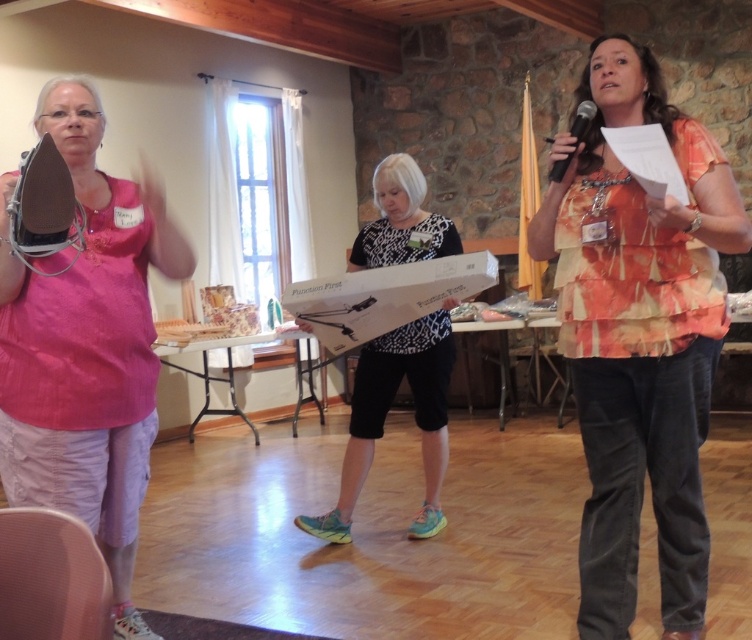
You are a photographer positioned in the center of the room. You need to capture a clear photo of both the matte pink shirt at left and the black plastic microphone at upper right. Which object should you focus on first to ensure both are in focus?

The matte pink shirt at left is closer to the viewer than the black plastic microphone at upper right. To ensure both are in focus, you should focus on the matte pink shirt at left first, as it is closer, and the depth of field will extend to the microphone further away.

You are a photographer setting up for an event. You need to position a camera to capture both the matte pink shirt at left and the black plastic microphone at upper right in the frame. Based on their heights, which object should you adjust the camera angle to focus on first to ensure both are visible?

The matte pink shirt at left is taller than the black plastic microphone at upper right, so you should adjust the camera angle to focus on the matte pink shirt at left first to ensure both are visible.

You are organizing a charity event and need to arrange participants based on their shirt height. You see a matte pink shirt at left and a white dotted shirt at center. Which shirt should be placed first in the order from tallest to shortest?

The matte pink shirt at left should be placed first in the order from tallest to shortest since it has a greater height compared to the white dotted shirt at center.